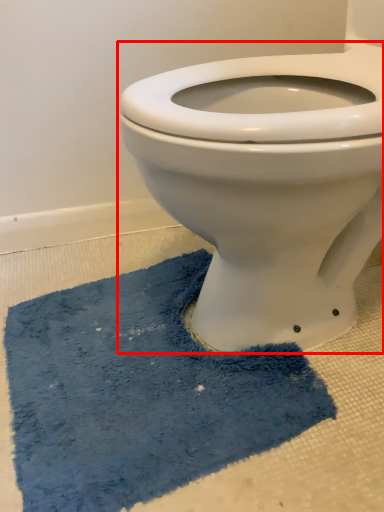
Question: Considering the relative positions of toilet (annotated by the red box) and bath mat in the image provided, where is toilet (annotated by the red box) located with respect to the staircase?

Choices:
 (A) right
 (B) left

Answer: (A)